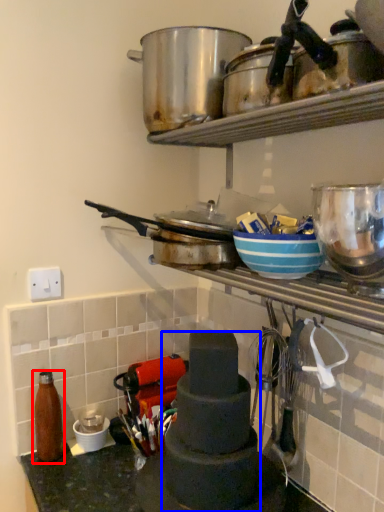
Question: Which point is closer to the camera, bottle (highlighted by a red box) or appliance (highlighted by a blue box)?

Choices:
 (A) bottle
 (B) appliance

Answer: (B)